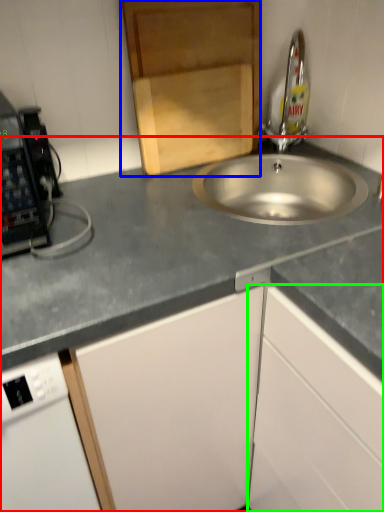
Question: Which object is the closest to the countertop (highlighted by a red box)? Choose among these: cabinetry (highlighted by a blue box) or cabinetry (highlighted by a green box).

Choices:
 (A) cabinetry
 (B) cabinetry

Answer: (B)